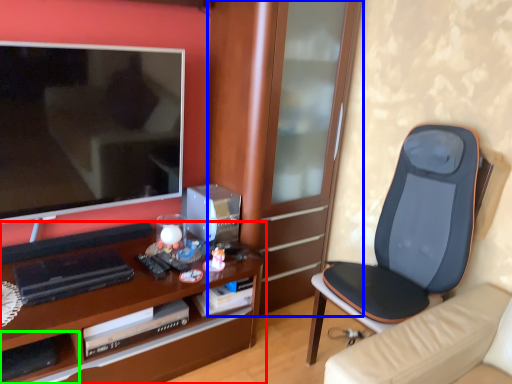
Question: Which object is the closest to the desk (highlighted by a red box)? Choose among these: cabinetry (highlighted by a blue box) or shelf (highlighted by a green box).

Choices:
 (A) cabinetry
 (B) shelf

Answer: (B)